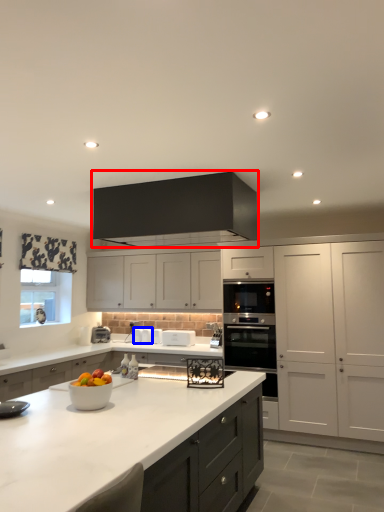
Question: Which object appears farthest to the camera in this image, cabinetry (highlighted by a red box) or appliance (highlighted by a blue box)?

Choices:
 (A) cabinetry
 (B) appliance

Answer: (B)